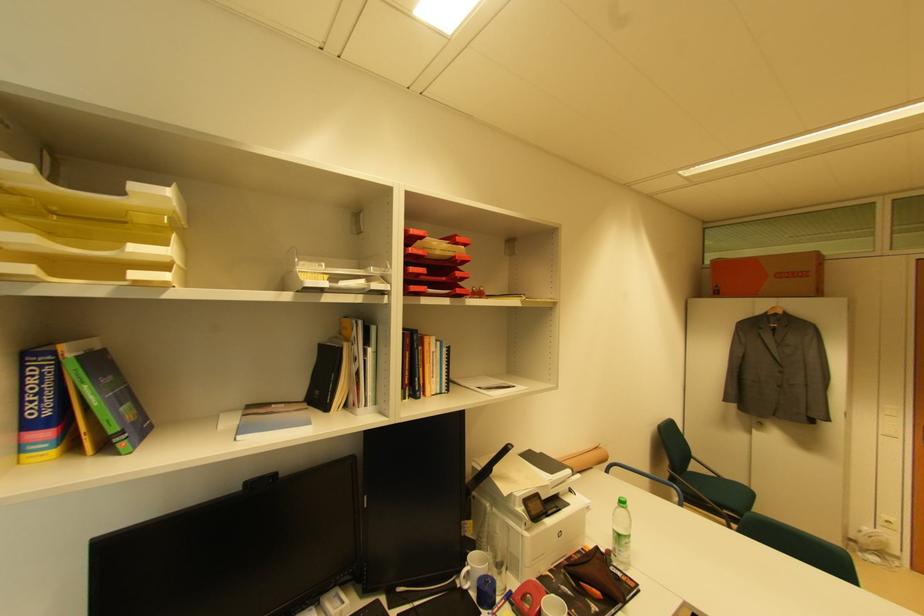
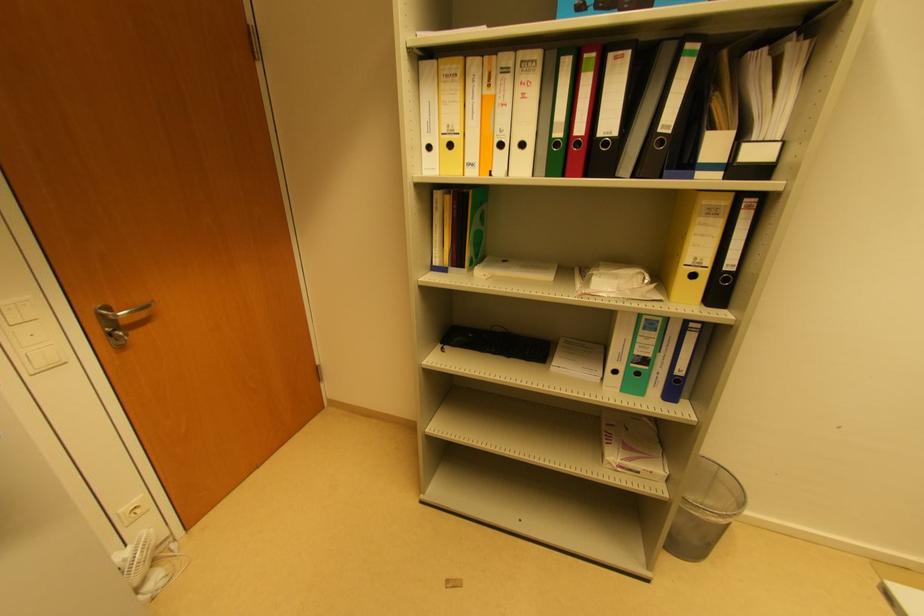
Find the pixel in the second image that matches (x=877, y=561) in the first image.

(157, 580)